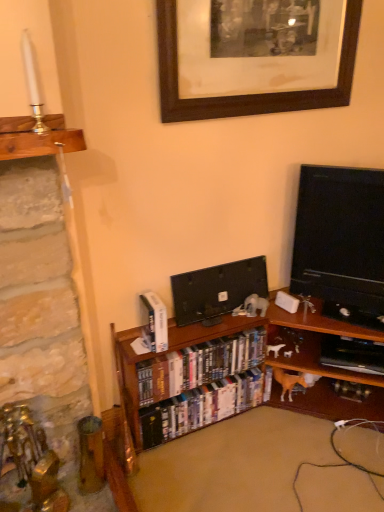
Question: Is hardcover books at center, acting as the 1th book starting from the bottom, positioned with its back to black glossy flat-screen tv at center, marked as the first television in a left-to-right arrangement?

Choices:
 (A) no
 (B) yes

Answer: (A)

Question: Is hardcover books at center, the third book positioned from the top, directly adjacent to black glossy flat-screen tv at center, marked as the first television in a left-to-right arrangement?

Choices:
 (A) no
 (B) yes

Answer: (A)

Question: Is hardcover books at center, the third book positioned from the top, thinner than black glossy flat-screen tv at center, marked as the first television in a left-to-right arrangement?

Choices:
 (A) no
 (B) yes

Answer: (A)

Question: Does hardcover books at center, the third book positioned from the top, have a greater height compared to black glossy flat-screen tv at center, placed as the second television when sorted from right to left?

Choices:
 (A) yes
 (B) no

Answer: (B)

Question: From the image's perspective, is hardcover books at center, acting as the 1th book starting from the bottom, over black glossy flat-screen tv at center, placed as the second television when sorted from right to left?

Choices:
 (A) yes
 (B) no

Answer: (B)

Question: From the image's perspective, is shiny plastic dvds at center, positioned as the 2th book in top-to-bottom order, positioned above or below black wood picture frame at upper center?

Choices:
 (A) above
 (B) below

Answer: (B)

Question: Choose the correct answer: Is shiny plastic dvds at center, positioned as the 2th book in top-to-bottom order, inside black wood picture frame at upper center or outside it?

Choices:
 (A) outside
 (B) inside

Answer: (A)

Question: In the image, is shiny plastic dvds at center, the second book ordered from the bottom, positioned in front of or behind black wood picture frame at upper center?

Choices:
 (A) behind
 (B) front

Answer: (A)

Question: Is shiny plastic dvds at center, the second book ordered from the bottom, bigger or smaller than black wood picture frame at upper center?

Choices:
 (A) big
 (B) small

Answer: (B)

Question: Choose the correct answer: Is shiny plastic dvds at center, positioned as the 2th book in top-to-bottom order, inside wooden bookcase at center or outside it?

Choices:
 (A) inside
 (B) outside

Answer: (A)

Question: Does point (244, 340) appear closer or farther from the camera than point (182, 330)?

Choices:
 (A) closer
 (B) farther

Answer: (B)

Question: Based on their sizes in the image, would you say shiny plastic dvds at center, positioned as the 2th book in top-to-bottom order, is bigger or smaller than wooden bookcase at center?

Choices:
 (A) small
 (B) big

Answer: (A)

Question: Considering the positions of shiny plastic dvds at center, positioned as the 2th book in top-to-bottom order, and wooden bookcase at center in the image, is shiny plastic dvds at center, positioned as the 2th book in top-to-bottom order, taller or shorter than wooden bookcase at center?

Choices:
 (A) tall
 (B) short

Answer: (B)

Question: Considering the positions of hardcover books at center, the third book positioned from the top, and black wood picture frame at upper center in the image, is hardcover books at center, the third book positioned from the top, bigger or smaller than black wood picture frame at upper center?

Choices:
 (A) small
 (B) big

Answer: (A)

Question: Based on their positions, is hardcover books at center, the third book positioned from the top, located to the left or right of black wood picture frame at upper center?

Choices:
 (A) right
 (B) left

Answer: (B)